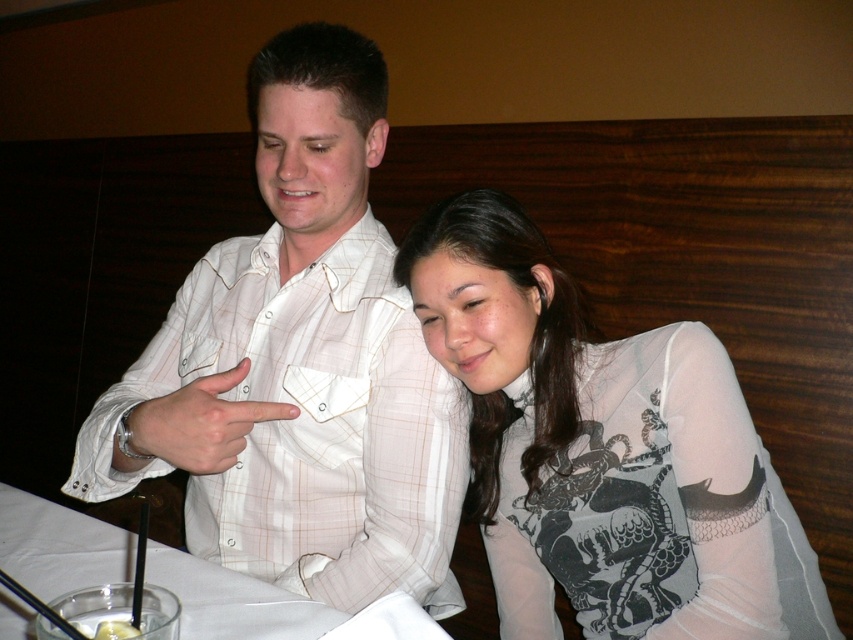
Based on the coordinates provided, which of the two points, point (376, 438) or point (674, 422), is located behind the other in the image?

Point (376, 438) is behind point (674, 422) in the image.

In the scene shown: You are a customer sitting at the table in the restaurant. You notice two points on the tablecloth. The first point is at coordinates point [303,67] and the second is at point [241,364]. Which point is closer to you?

Point [303,67] is closer to you because it is further to the viewer than point [241,364].

You are a waiter in a restaurant and need to deliver a drink to the table. The sheer white blouse at center and the white matte finger at center are on the table. Where should you place the drink to avoid covering either object?

Place the drink above the sheer white blouse at center since it is below the white matte finger at center, ensuring the drink doesn